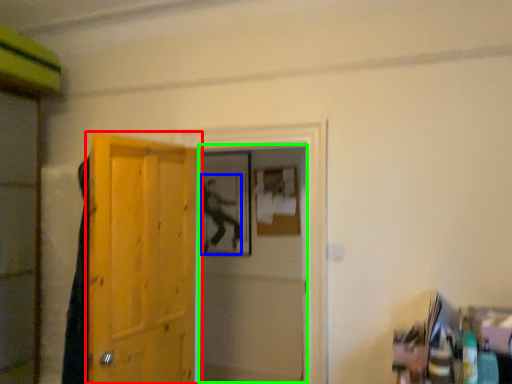
Question: Which is farther away from door (highlighted by a red box)? person (highlighted by a blue box) or screen door (highlighted by a green box)?

Choices:
 (A) person
 (B) screen door

Answer: (A)